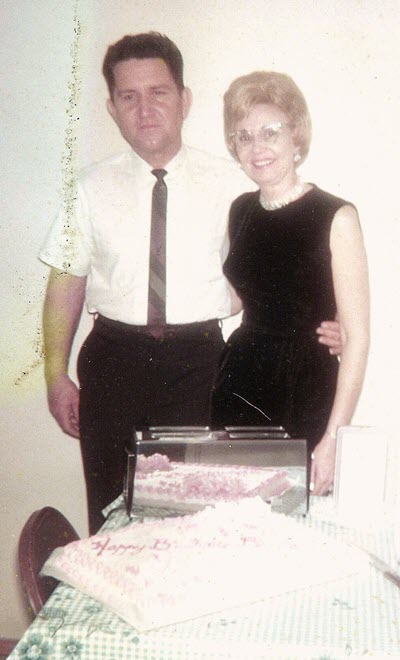
Locate an element on the screen. The width and height of the screenshot is (400, 660). wall is located at coordinates (268, 51).